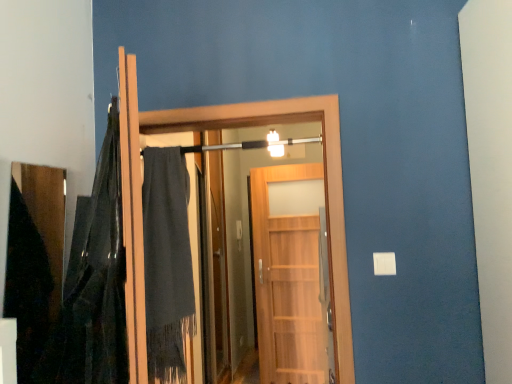
Question: Is the position of velvet dark gray blanket at left more distant than that of wooden door at center, which is the first door from front to back?

Choices:
 (A) no
 (B) yes

Answer: (A)

Question: Considering the relative sizes of velvet dark gray blanket at left and wooden door at center, which is the first door from front to back, in the image provided, is velvet dark gray blanket at left wider than wooden door at center, which is the first door from front to back,?

Choices:
 (A) yes
 (B) no

Answer: (B)

Question: Does velvet dark gray blanket at left contain wooden door at center, which is the first door from front to back?

Choices:
 (A) no
 (B) yes

Answer: (A)

Question: Is velvet dark gray blanket at left at the right side of wooden door at center, which is the first door from front to back?

Choices:
 (A) no
 (B) yes

Answer: (A)

Question: Is velvet dark gray blanket at left next to wooden door at center, which is the first door from front to back?

Choices:
 (A) no
 (B) yes

Answer: (A)

Question: Is velvet dark gray blanket at left looking in the opposite direction of wooden door at center, which is the 2th door from back to front?

Choices:
 (A) yes
 (B) no

Answer: (B)

Question: From the image's perspective, is velvet dark gray blanket at left under wooden door at center, marked as the 1th door in a back-to-front arrangement?

Choices:
 (A) no
 (B) yes

Answer: (A)

Question: Is wooden door at center, marked as the 1th door in a back-to-front arrangement, at the back of velvet dark gray blanket at left?

Choices:
 (A) no
 (B) yes

Answer: (A)

Question: From a real-world perspective, is velvet dark gray blanket at left under wooden door at center, marked as the 1th door in a back-to-front arrangement?

Choices:
 (A) yes
 (B) no

Answer: (B)

Question: Does velvet dark gray blanket at left touch wooden door at center, marked as the 1th door in a back-to-front arrangement?

Choices:
 (A) no
 (B) yes

Answer: (A)

Question: Does velvet dark gray blanket at left turn towards wooden door at center, marked as the 2th door in a front-to-back arrangement?

Choices:
 (A) yes
 (B) no

Answer: (B)

Question: From the image's perspective, is velvet dark gray blanket at left over wooden door at center, marked as the 2th door in a front-to-back arrangement?

Choices:
 (A) yes
 (B) no

Answer: (A)

Question: From the image's perspective, is wooden door at center, which is the first door from front to back, below wooden door at center, marked as the 2th door in a front-to-back arrangement?

Choices:
 (A) no
 (B) yes

Answer: (A)